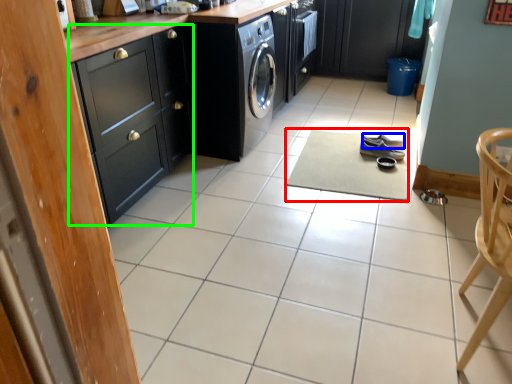
Question: Estimate the real-world distances between objects in this image. Which object is farther from wide (highlighted by a red box), footwear (highlighted by a blue box) or cabinetry (highlighted by a green box)?

Choices:
 (A) footwear
 (B) cabinetry

Answer: (B)